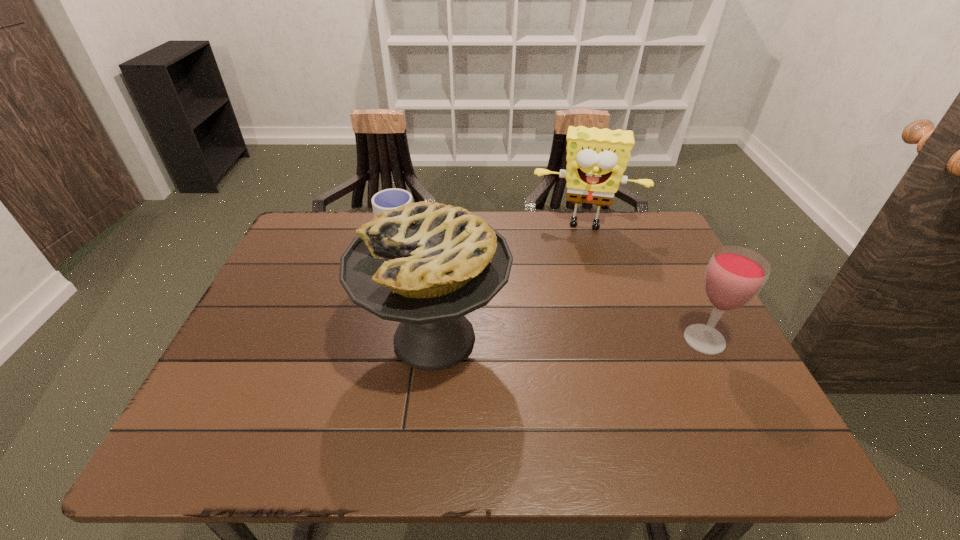
The image size is (960, 540). I want to click on pie, so click(x=426, y=264).

What are the coordinates of `the second shortest object` in the screenshot? It's located at (734, 276).

In order to click on the shortest object in this screenshot , I will do `click(387, 199)`.

The width and height of the screenshot is (960, 540). I want to click on sponge, so click(x=596, y=158).

Find the location of `free space located 0.250m on the cut side of the pie`. free space located 0.250m on the cut side of the pie is located at coordinates (253, 338).

Locate an element on the screen. free spot located on the cut side of the pie is located at coordinates (276, 338).

Identify the location of free spot located 0.260m on the cut side of the pie. The width and height of the screenshot is (960, 540). (x=250, y=338).

This screenshot has width=960, height=540. What are the coordinates of `vacant space located 0.400m on the left of the second shortest object` in the screenshot? It's located at (509, 340).

At what (x,y) coordinates should I click in order to perform the action: click on free point located 0.320m with the handle on the side of the shortest object. Please return your answer as a coordinate pair (x, y). Looking at the image, I should click on (494, 304).

Image resolution: width=960 pixels, height=540 pixels. I want to click on vacant space situated with the handle on the side of the shortest object, so pyautogui.click(x=470, y=287).